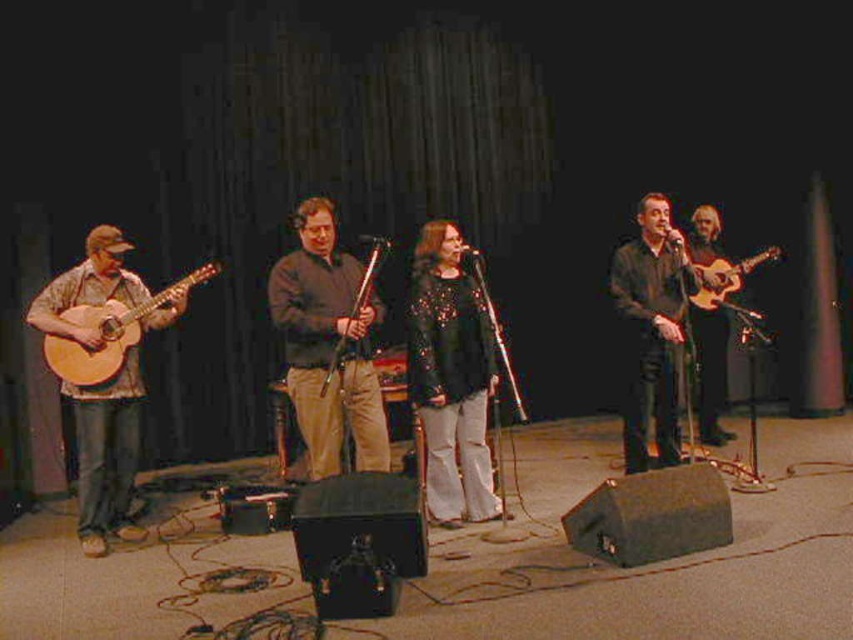
Is matte brown acoustic guitar at center to the left of sparkly black dress at center from the viewer's perspective?

Correct, you'll find matte brown acoustic guitar at center to the left of sparkly black dress at center.

Consider the image. Does matte brown acoustic guitar at center have a greater width compared to sparkly black dress at center?

Indeed, matte brown acoustic guitar at center has a greater width compared to sparkly black dress at center.

Is point (296, 349) behind point (450, 337)?

That is False.

Find the location of a particular element. The image size is (853, 640). matte brown acoustic guitar at center is located at coordinates (328, 346).

Who is positioned more to the right, matte brown acoustic guitar at center or natural wood acoustic guitar at left?

matte brown acoustic guitar at center

Does matte brown acoustic guitar at center have a lesser height compared to natural wood acoustic guitar at left?

In fact, matte brown acoustic guitar at center may be taller than natural wood acoustic guitar at left.

Find the location of a particular element. matte brown acoustic guitar at center is located at coordinates (328, 346).

The width and height of the screenshot is (853, 640). Identify the location of matte brown acoustic guitar at center. (328, 346).

Can you confirm if matte brown guitar at left is positioned to the left of sparkly black dress at center?

Correct, you'll find matte brown guitar at left to the left of sparkly black dress at center.

Is point (468, 451) closer to viewer compared to point (437, 272)?

No.

You are a GUI agent. You are given a task and a screenshot of the screen. Output one action in this format:
    pyautogui.click(x=<x>, y=<y>)
    Task: Click on the matte brown guitar at left
    
    Given the screenshot: What is the action you would take?
    pyautogui.click(x=339, y=413)